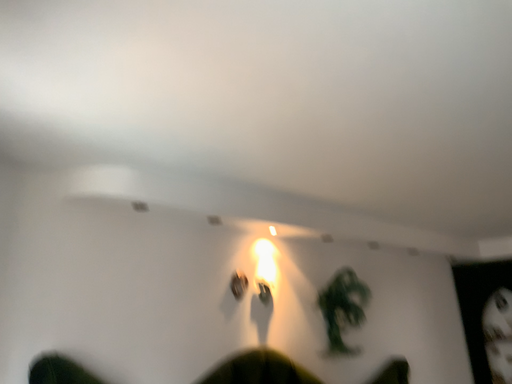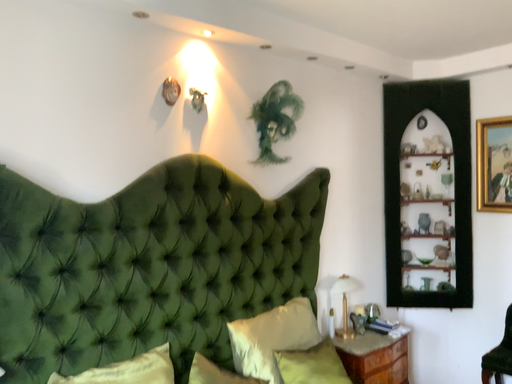
Question: How did the camera likely rotate when shooting the video?

Choices:
 (A) rotated right
 (B) rotated left

Answer: (A)